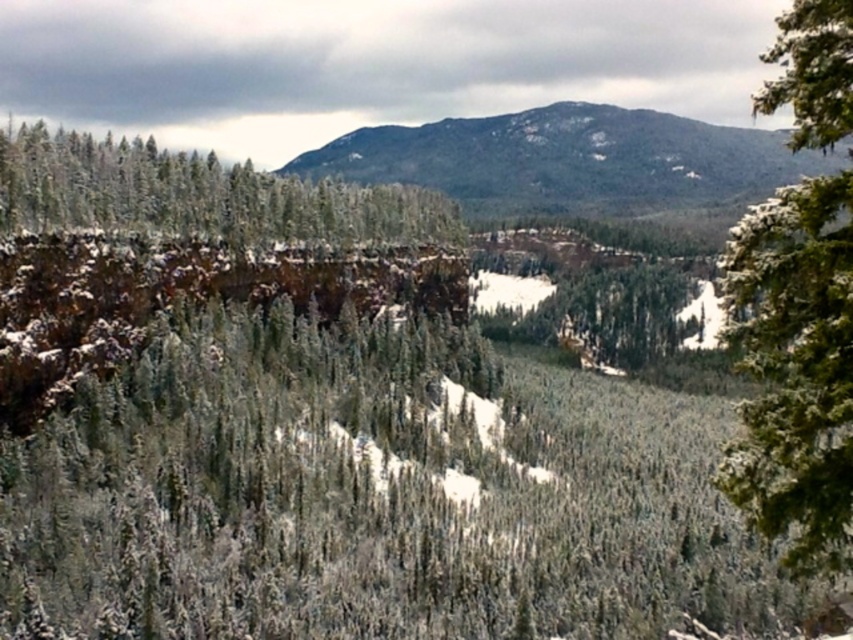
Is point (601, 131) more distant than point (421, 216)?

Yes, point (601, 131) is behind point (421, 216).

Is sandy brown rock at center bigger than green matte evergreen tree at left?

Yes.

Which is in front, point (804, 152) or point (10, 189)?

Point (10, 189) is in front.

At what (x,y) coordinates should I click in order to perform the action: click on sandy brown rock at center. Please return your answer as a coordinate pair (x, y). Looking at the image, I should click on (572, 161).

Does point (831, 257) come in front of point (511, 147)?

Yes.

Can you confirm if green textured pine tree at right is positioned to the left of sandy brown rock at center?

Indeed, green textured pine tree at right is positioned on the left side of sandy brown rock at center.

This screenshot has height=640, width=853. I want to click on green textured pine tree at right, so click(x=795, y=369).

From the picture: Who is higher up, green textured pine tree at right or green matte evergreen tree at left?

green matte evergreen tree at left

Can you confirm if green textured pine tree at right is positioned to the right of green matte evergreen tree at left?

Yes, green textured pine tree at right is to the right of green matte evergreen tree at left.

Is point (769, 397) more distant than point (338, 202)?

No.

The height and width of the screenshot is (640, 853). What are the coordinates of `green textured pine tree at right` in the screenshot? It's located at (795, 369).